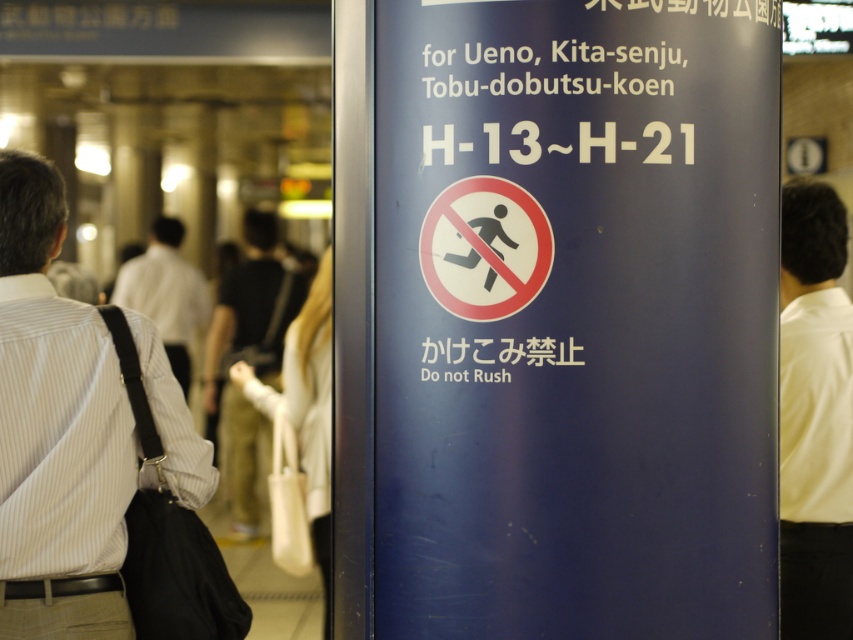
Question: Does white striped shirt at left have a lesser width compared to light brown leather jacket at center?

Choices:
 (A) yes
 (B) no

Answer: (A)

Question: Which point is closer to the camera taking this photo?

Choices:
 (A) (229, 451)
 (B) (795, 584)
 (C) (180, 467)
 (D) (173, 369)

Answer: (C)

Question: Can you confirm if white shirt at right is positioned to the left of white shirt at left?

Choices:
 (A) yes
 (B) no

Answer: (B)

Question: Does light brown leather jacket at center appear under white shirt at left?

Choices:
 (A) yes
 (B) no

Answer: (A)

Question: Among these points, which one is farthest from the camera?

Choices:
 (A) (62, 529)
 (B) (250, 512)
 (C) (827, 237)

Answer: (B)

Question: Which point is closer to the camera taking this photo?

Choices:
 (A) (25, 608)
 (B) (799, 412)
 (C) (175, 250)

Answer: (A)